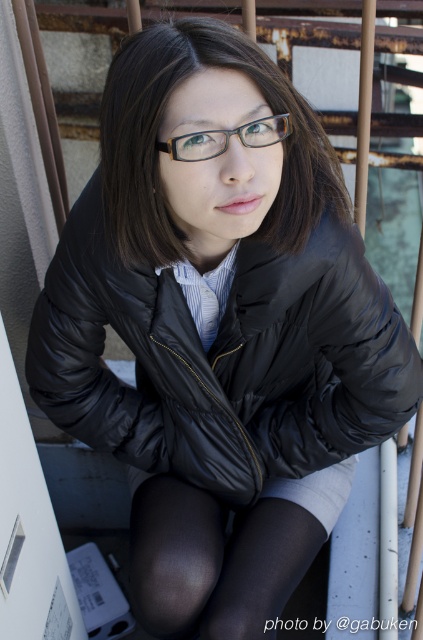
Is point (139, 234) closer to viewer compared to point (280, 140)?

No, (139, 234) is further to viewer.

Is matte black jacket at center below clear plastic glasses at center?

No, matte black jacket at center is not below clear plastic glasses at center.

Between point (307, 179) and point (184, 152), which one is positioned behind?

Positioned behind is point (307, 179).

The width and height of the screenshot is (423, 640). What are the coordinates of `matte black jacket at center` in the screenshot? It's located at (159, 141).

Who is more forward, (164, 496) or (268, 125)?

Point (268, 125) is in front.

Does point (272, 577) come farther from viewer compared to point (225, 145)?

Yes, it is behind point (225, 145).

Between point (315, 536) and point (277, 124), which one is positioned in front?

Point (277, 124) is in front.

Identify the location of black tights at lower center. The image size is (423, 640). (225, 552).

Can you confirm if matte black jacket at center is positioned below black tights at lower center?

Incorrect, matte black jacket at center is not positioned below black tights at lower center.

Who is taller, matte black jacket at center or black tights at lower center?

matte black jacket at center

Who is more forward, (x=239, y=38) or (x=151, y=547)?

Point (x=239, y=38) is in front.

Identify the location of matte black jacket at center. (159, 141).